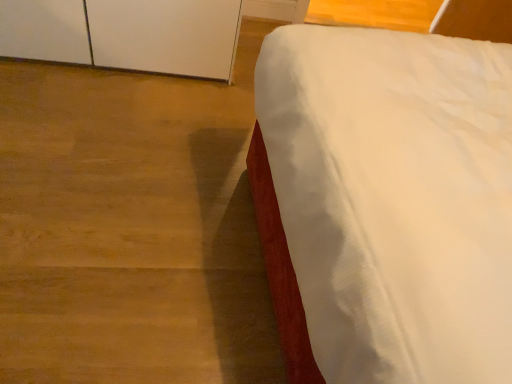
Find the location of a particular element. The height and width of the screenshot is (384, 512). vacant area on top of white fabric bed at right (from a real-world perspective) is located at coordinates (131, 182).